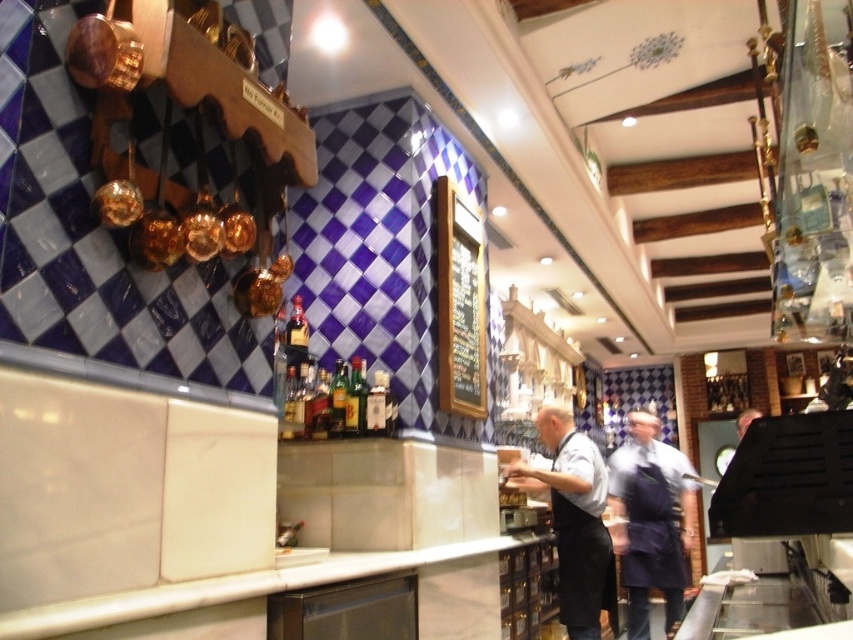
You are a customer in this restaurant and you want to place your drink on a surface. Which object can you use between the dark blue apron at center and the white marble counter at center?

The white marble counter at center is the appropriate surface for placing a drink since the dark blue apron at center is located below it and is likely meant for staff use.

Consider the image. You are a customer at this restaurant and want to place your drink on a surface. Which object, the white marble counter at center or the black apron at center, is more suitable for placing a drink?

The white marble counter at center is more suitable because it is larger in size than the black apron at center, providing a stable and flat surface for placing a drink.